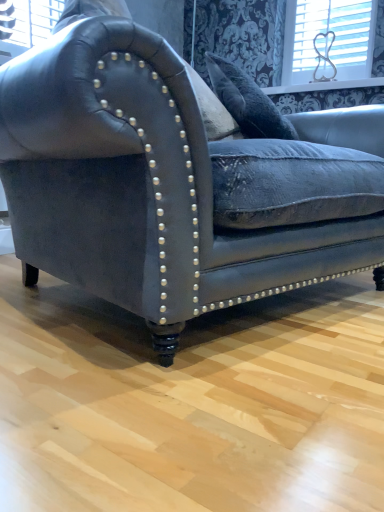
In the scene shown: Measure the distance between point (x=303, y=40) and camera.

The depth of point (x=303, y=40) is 2.60 meters.

Describe the element at coordinates (334, 40) in the screenshot. This screenshot has height=512, width=384. I see `white plastic heart at upper right` at that location.

Locate an element on the screen. The height and width of the screenshot is (512, 384). white plastic heart at upper right is located at coordinates (334, 40).

What is the approximate width of matte black leather couch at center?

The width of matte black leather couch at center is 3.48 feet.

The width and height of the screenshot is (384, 512). What do you see at coordinates (141, 186) in the screenshot?
I see `matte black leather couch at center` at bounding box center [141, 186].

Measure the distance between point (86, 120) and camera.

Point (86, 120) is 27.68 inches away from camera.

The height and width of the screenshot is (512, 384). In order to click on matte black leather couch at center in this screenshot , I will do `click(141, 186)`.

The width and height of the screenshot is (384, 512). In order to click on white plastic heart at upper right in this screenshot , I will do `click(334, 40)`.

Considering the relative positions of white plastic heart at upper right and matte black leather couch at center in the image provided, is white plastic heart at upper right to the left of matte black leather couch at center from the viewer's perspective?

No.

Is white plastic heart at upper right further to the viewer compared to matte black leather couch at center?

That is True.

Is point (292, 73) farther from viewer compared to point (176, 322)?

That is True.

From the image's perspective, is white plastic heart at upper right positioned above or below matte black leather couch at center?

white plastic heart at upper right is situated higher than matte black leather couch at center in the image.

From the picture: From a real-world perspective, is white plastic heart at upper right over matte black leather couch at center?

Yes, from a real-world perspective, white plastic heart at upper right is on top of matte black leather couch at center.

Considering the relative sizes of white plastic heart at upper right and matte black leather couch at center in the image provided, is white plastic heart at upper right wider than matte black leather couch at center?

No, white plastic heart at upper right is not wider than matte black leather couch at center.

Which of these two, white plastic heart at upper right or matte black leather couch at center, stands shorter?

Standing shorter between the two is white plastic heart at upper right.

Which of these two, white plastic heart at upper right or matte black leather couch at center, is bigger?

With larger size is matte black leather couch at center.

Which is correct: white plastic heart at upper right is inside matte black leather couch at center, or outside of it?

white plastic heart at upper right is not enclosed by matte black leather couch at center.

Is white plastic heart at upper right positioned far away from matte black leather couch at center?

That's right, there is a large distance between white plastic heart at upper right and matte black leather couch at center.

Is matte black leather couch at center at the back of white plastic heart at upper right?

white plastic heart at upper right does not have its back to matte black leather couch at center.

How many degrees apart are the facing directions of white plastic heart at upper right and matte black leather couch at center?

The angle between the facing direction of white plastic heart at upper right and the facing direction of matte black leather couch at center is 77.4 degrees.

How much distance is there between white plastic heart at upper right and matte black leather couch at center?

The distance of white plastic heart at upper right from matte black leather couch at center is 5.93 feet.

This screenshot has width=384, height=512. I want to click on window behind the matte black leather couch at center, so pos(334,40).

Is matte black leather couch at center to the right of white plastic heart at upper right from the viewer's perspective?

No, matte black leather couch at center is not to the right of white plastic heart at upper right.

Which object is more forward, matte black leather couch at center or white plastic heart at upper right?

matte black leather couch at center.

Considering the positions of point (12, 170) and point (354, 1), is point (12, 170) closer or farther from the camera than point (354, 1)?

Point (12, 170) is closer to the camera than point (354, 1).

From the image's perspective, is matte black leather couch at center beneath white plastic heart at upper right?

Yes, from the image's perspective, matte black leather couch at center is beneath white plastic heart at upper right.

From a real-world perspective, between matte black leather couch at center and white plastic heart at upper right, who is vertically lower?

matte black leather couch at center.

Does matte black leather couch at center have a lesser width compared to white plastic heart at upper right?

No.

Considering the sizes of objects matte black leather couch at center and white plastic heart at upper right in the image provided, who is shorter, matte black leather couch at center or white plastic heart at upper right?

white plastic heart at upper right.

Which of these two, matte black leather couch at center or white plastic heart at upper right, is bigger?

With larger size is matte black leather couch at center.

Can white plastic heart at upper right be found inside matte black leather couch at center?

No, white plastic heart at upper right is not surrounded by matte black leather couch at center.

Is matte black leather couch at center touching white plastic heart at upper right?

No, matte black leather couch at center is not with white plastic heart at upper right.

Is matte black leather couch at center oriented away from white plastic heart at upper right?

No, matte black leather couch at center's orientation is not away from white plastic heart at upper right.

How many degrees apart are the facing directions of matte black leather couch at center and white plastic heart at upper right?

They differ by 77.4 degrees in their facing directions.

Identify the location of studio couch located below the white plastic heart at upper right (from the image's perspective). The height and width of the screenshot is (512, 384). (141, 186).

There is a matte black leather couch at center. At what (x,y) coordinates should I click in order to perform the action: click on window above it (from a real-world perspective). Please return your answer as a coordinate pair (x, y). This screenshot has height=512, width=384. Looking at the image, I should click on (334, 40).

Identify the location of studio couch below the white plastic heart at upper right (from a real-world perspective). Image resolution: width=384 pixels, height=512 pixels. (141, 186).